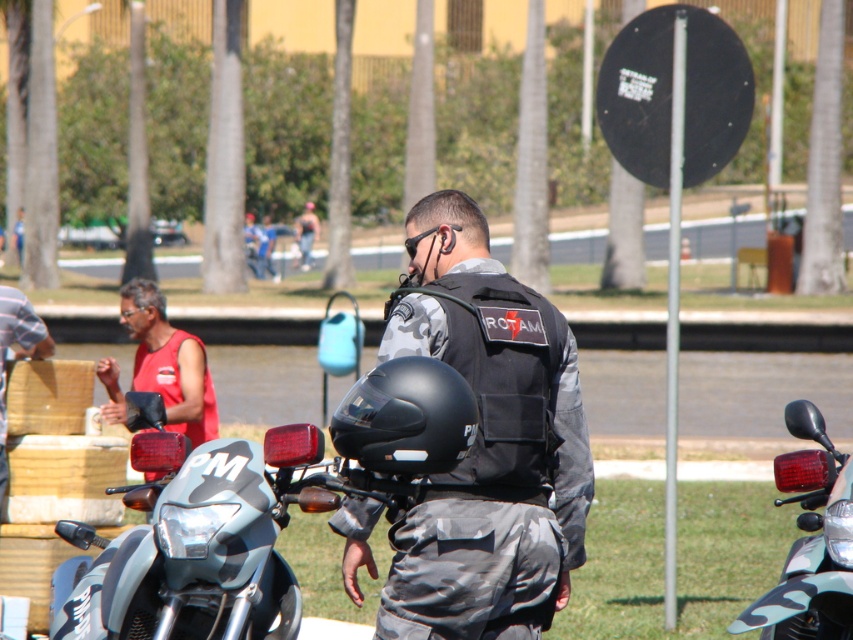
Looking at this image, does matte black helmet at center appear on the right side of red sleeveless shirt at left?

Indeed, matte black helmet at center is positioned on the right side of red sleeveless shirt at left.

Is point (373, 369) closer to camera compared to point (195, 378)?

Yes, point (373, 369) is in front of point (195, 378).

Who is more distant from viewer, (415, 392) or (148, 324)?

Positioned behind is point (148, 324).

Image resolution: width=853 pixels, height=640 pixels. I want to click on matte black helmet at center, so [x=405, y=417].

Does matte black motorcycle at right appear under red sleeveless shirt at left?

Yes.

Which is behind, point (839, 467) or point (193, 401)?

The point (193, 401) is more distant.

Which is in front, point (813, 576) or point (111, 412)?

Point (813, 576)

Locate an element on the screen. matte black motorcycle at right is located at coordinates (810, 541).

Is camouflage uniform at center taller than matte black motorcycle at right?

Yes.

Does camouflage uniform at center have a lesser width compared to matte black motorcycle at right?

No.

Consider the image. Who is more forward, [445,314] or [770,609]?

Point [445,314] is in front.

I want to click on camouflage uniform at center, so click(x=486, y=444).